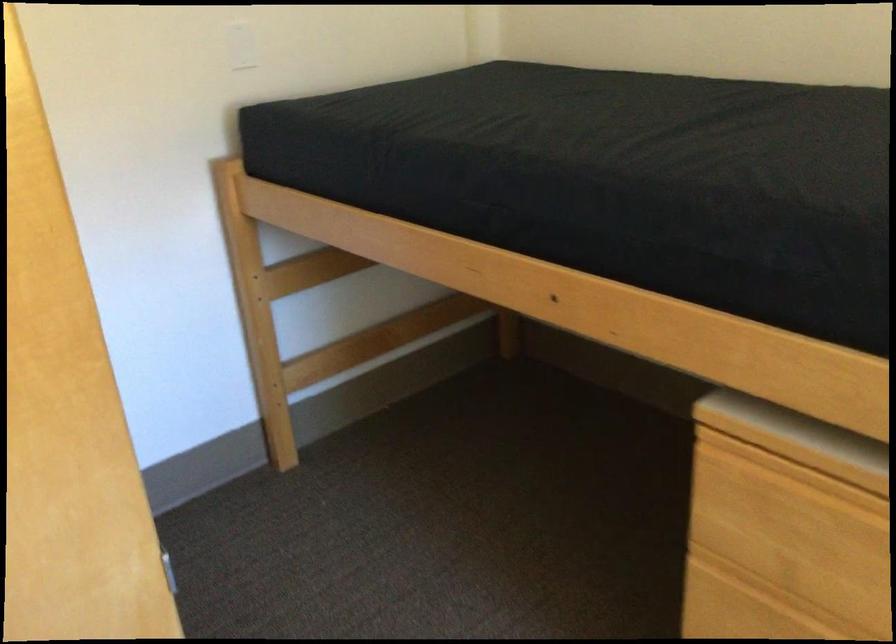
The width and height of the screenshot is (896, 644). Describe the element at coordinates (837, 474) in the screenshot. I see `a drawer handle lip` at that location.